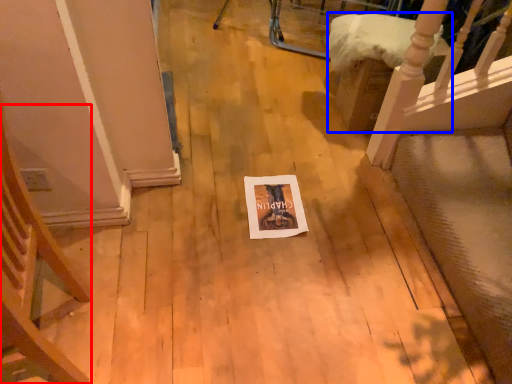
Question: Which object appears closest to the camera in this image, armchair (highlighted by a red box) or furniture (highlighted by a blue box)?

Choices:
 (A) armchair
 (B) furniture

Answer: (A)